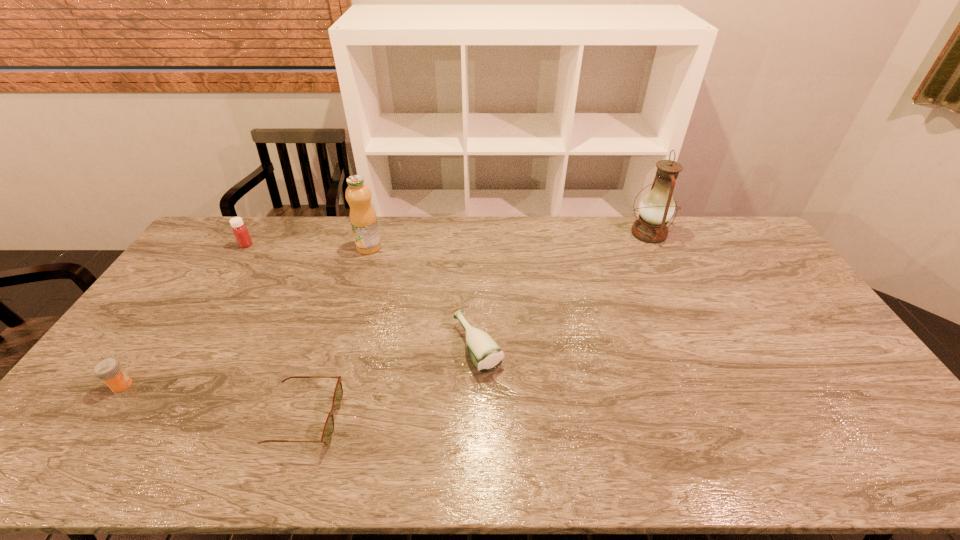
Where is `the tallest object`? Image resolution: width=960 pixels, height=540 pixels. the tallest object is located at coordinates (656, 208).

Locate an element on the screen. The width and height of the screenshot is (960, 540). oil lamp is located at coordinates (656, 208).

In order to click on fruit juice in this screenshot , I will do `click(363, 220)`.

Locate an element on the screen. the taller medicine is located at coordinates pyautogui.click(x=240, y=231).

The height and width of the screenshot is (540, 960). In order to click on the fourth shortest object in this screenshot , I will do `click(240, 231)`.

What are the coordinates of `the fifth object from left to right` in the screenshot? It's located at (485, 353).

This screenshot has width=960, height=540. Find the location of `the left medicine`. the left medicine is located at coordinates (109, 370).

You are a GUI agent. You are given a task and a screenshot of the screen. Output one action in this format:
    pyautogui.click(x=<x>, y=<y>)
    Task: Click on the shorter medicine
    
    Given the screenshot: What is the action you would take?
    pyautogui.click(x=109, y=370)

Where is `spectacles`? spectacles is located at coordinates (328, 430).

Find the location of a particular element. vacant space located on the left of the oil lamp is located at coordinates (550, 233).